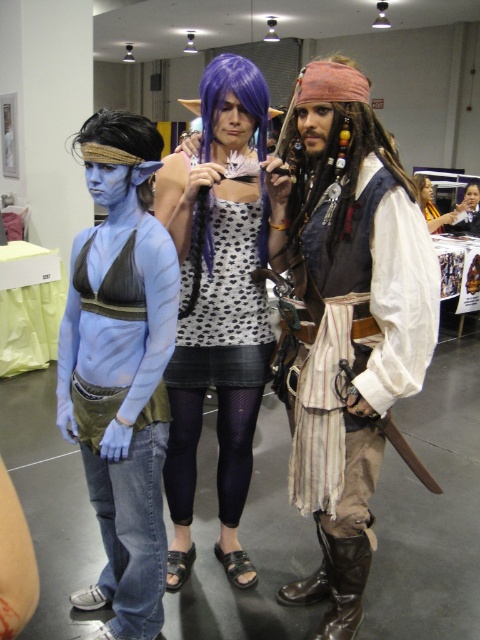
You are a photographer at the event and want to capture a photo that shows both the leather vest at center and the polka dot fabric dress at center. Which object should you focus on first if you want to ensure both are in frame without moving the camera?

The leather vest at center is shorter than the polka dot fabric dress at center. To include both in the frame, focus on the taller object first, the polka dot fabric dress at center, then adjust the camera angle to include the shorter leather vest at center.

You are standing in the convention hall and see two points marked in the image. Which point, point (116, 148) or point (432, 232), is closer to you?

Point (116, 148) is closer to the camera than point (432, 232).